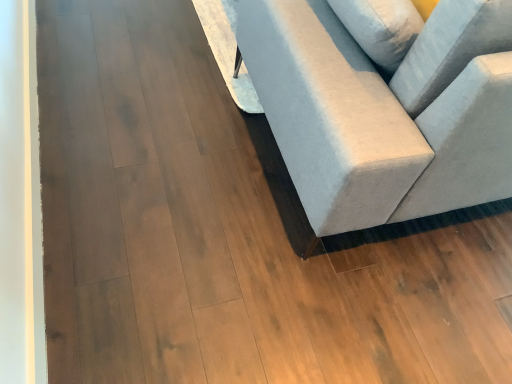
Identify the location of light gray fabric couch at right. The width and height of the screenshot is (512, 384). (380, 117).

What is the approximate width of light gray fabric couch at right?

light gray fabric couch at right is 1.49 meters in width.

Describe the element at coordinates (380, 117) in the screenshot. I see `light gray fabric couch at right` at that location.

Find the location of a particular element. The width and height of the screenshot is (512, 384). light gray fabric couch at right is located at coordinates (380, 117).